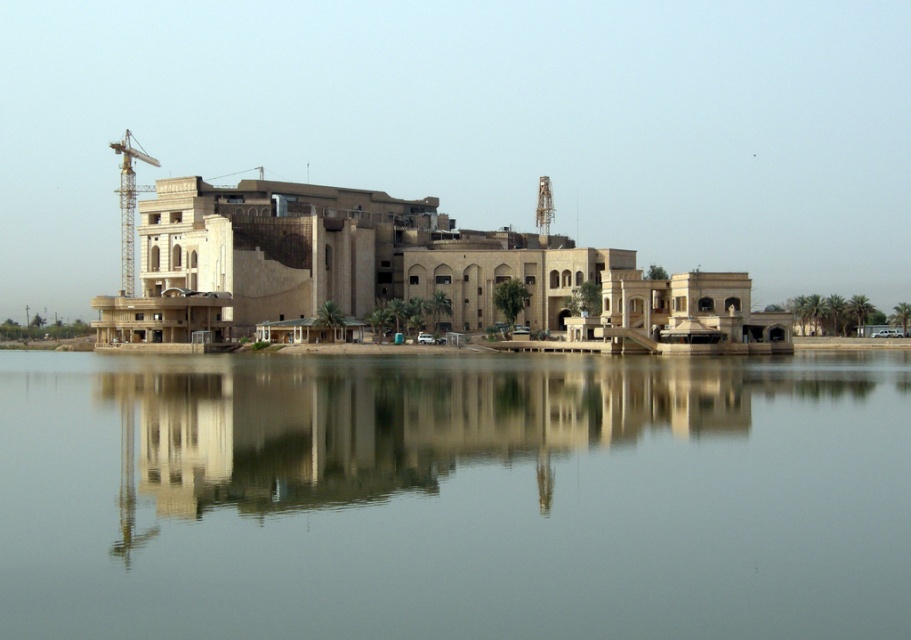
You are standing on a dock near the smooth gray water at center and want to take a photo of the beige stone building at center. Which object should you move closer to in order to get a better view of the building?

The smooth gray water at center is in front of the beige stone building at center, so you should move closer to the beige stone building at center to get a better view.

You are a construction worker standing on the yellow metallic crane at left. You need to place a heavy object into the smooth gray water at center. The object requires a minimum of 120 meters of space to safely land. Can you safely place the object from your current position?

The distance between the yellow metallic crane at left and the smooth gray water at center is 128.23 meters, which exceeds the required 120 meters. Therefore, you can safely place the object from your current position.

From the picture: You are standing on the dock and want to take a photo of the beige stone building at center and its reflection in the smooth gray water at center. Which object should you focus on first to ensure both are in frame?

You should focus on the beige stone building at center first because the smooth gray water at center is positioned to its right, so framing the building first ensures the reflection will also be captured in the shot.